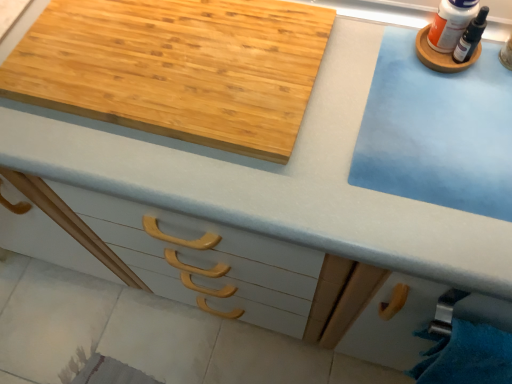
Locate an element on the screen. free space on the front side of natural wood cutting board at upper left is located at coordinates (221, 184).